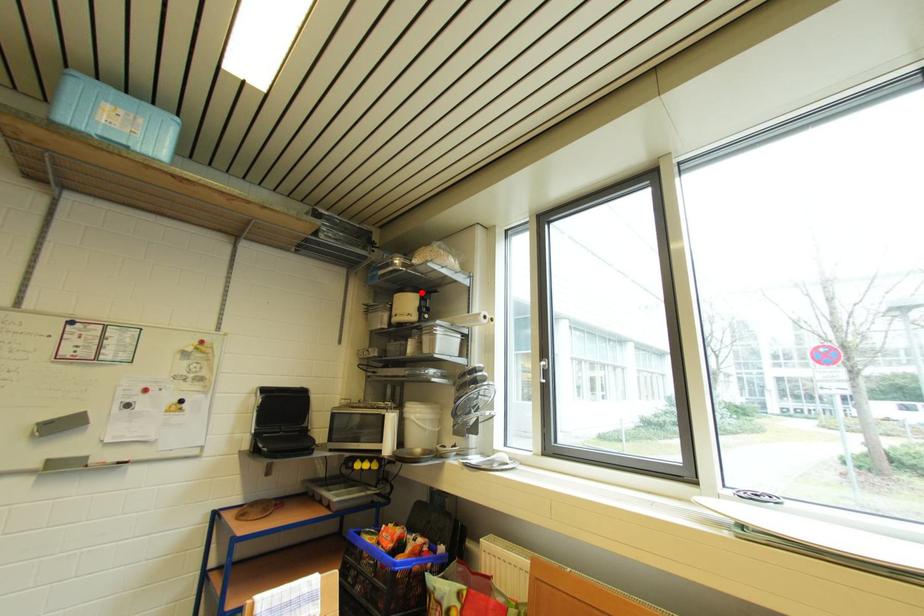
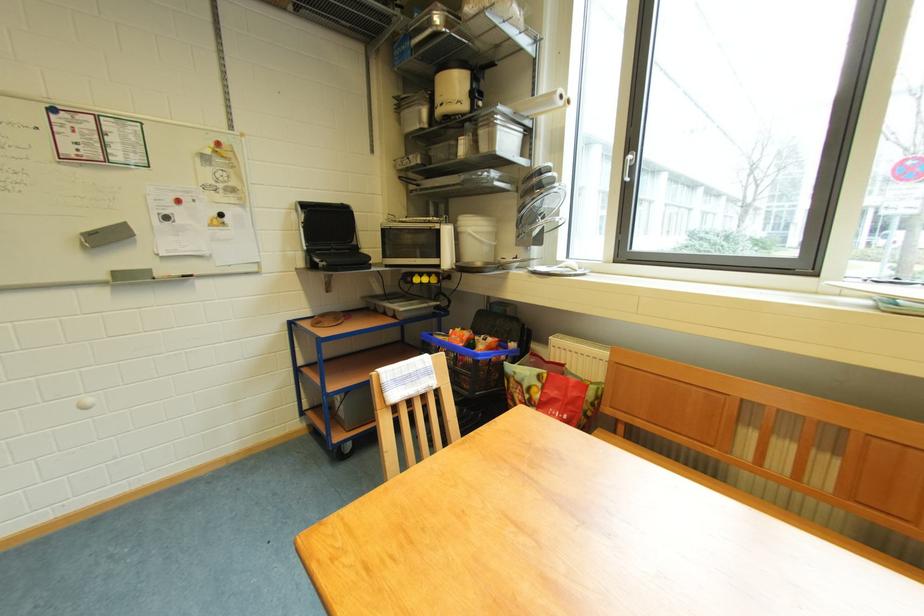
Locate, in the second image, the point that corresponds to the highlighted location in the first image.

(469, 68)